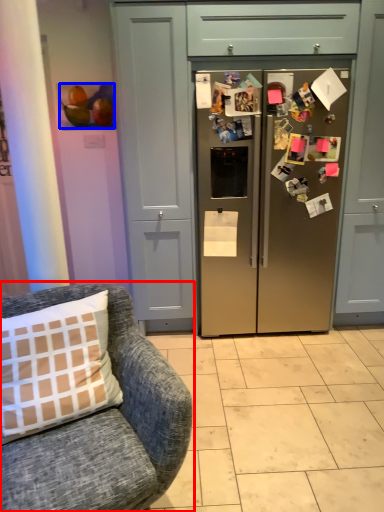
Question: Which object appears farthest to the camera in this image, chair (highlighted by a red box) or fruit (highlighted by a blue box)?

Choices:
 (A) chair
 (B) fruit

Answer: (B)